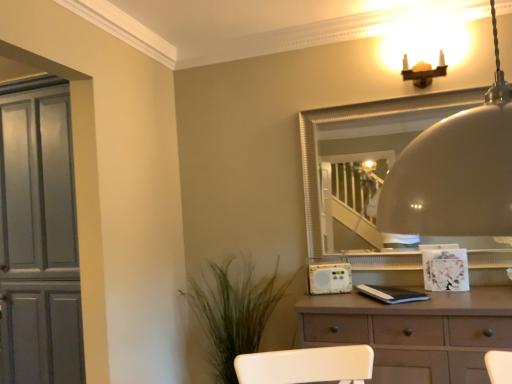
Question: From a real-world perspective, does matte gray cabinet at left sit lower than brown matte chest of drawers at center?

Choices:
 (A) no
 (B) yes

Answer: (A)

Question: Is matte gray cabinet at left looking in the opposite direction of brown matte chest of drawers at center?

Choices:
 (A) yes
 (B) no

Answer: (B)

Question: From the image's perspective, does matte gray cabinet at left appear higher than brown matte chest of drawers at center?

Choices:
 (A) yes
 (B) no

Answer: (A)

Question: Considering the relative positions of matte gray cabinet at left and brown matte chest of drawers at center in the image provided, is matte gray cabinet at left to the left of brown matte chest of drawers at center from the viewer's perspective?

Choices:
 (A) no
 (B) yes

Answer: (B)

Question: Is matte gray cabinet at left taller than brown matte chest of drawers at center?

Choices:
 (A) no
 (B) yes

Answer: (B)

Question: In terms of width, does matte gray cabinet at left look wider or thinner when compared to white plastic radio at center?

Choices:
 (A) thin
 (B) wide

Answer: (B)

Question: Is point (73, 382) closer or farther from the camera than point (323, 292)?

Choices:
 (A) farther
 (B) closer

Answer: (A)

Question: Is matte gray cabinet at left inside the boundaries of white plastic radio at center, or outside?

Choices:
 (A) outside
 (B) inside

Answer: (A)

Question: From the image's perspective, is matte gray cabinet at left positioned above or below white plastic radio at center?

Choices:
 (A) below
 (B) above

Answer: (B)

Question: Is point (349, 198) positioned closer to the camera than point (31, 112)?

Choices:
 (A) closer
 (B) farther

Answer: (B)

Question: Is silver textured mirror at upper center situated inside matte gray cabinet at left or outside?

Choices:
 (A) outside
 (B) inside

Answer: (A)

Question: From a real-world perspective, is silver textured mirror at upper center above or below matte gray cabinet at left?

Choices:
 (A) below
 (B) above

Answer: (B)

Question: Considering the positions of silver textured mirror at upper center and matte gray cabinet at left in the image, is silver textured mirror at upper center taller or shorter than matte gray cabinet at left?

Choices:
 (A) short
 (B) tall

Answer: (A)

Question: Looking at their shapes, would you say green leafy plant at lower left is wider or thinner than silver textured mirror at upper center?

Choices:
 (A) wide
 (B) thin

Answer: (A)

Question: From the image's perspective, relative to silver textured mirror at upper center, is green leafy plant at lower left above or below?

Choices:
 (A) below
 (B) above

Answer: (A)